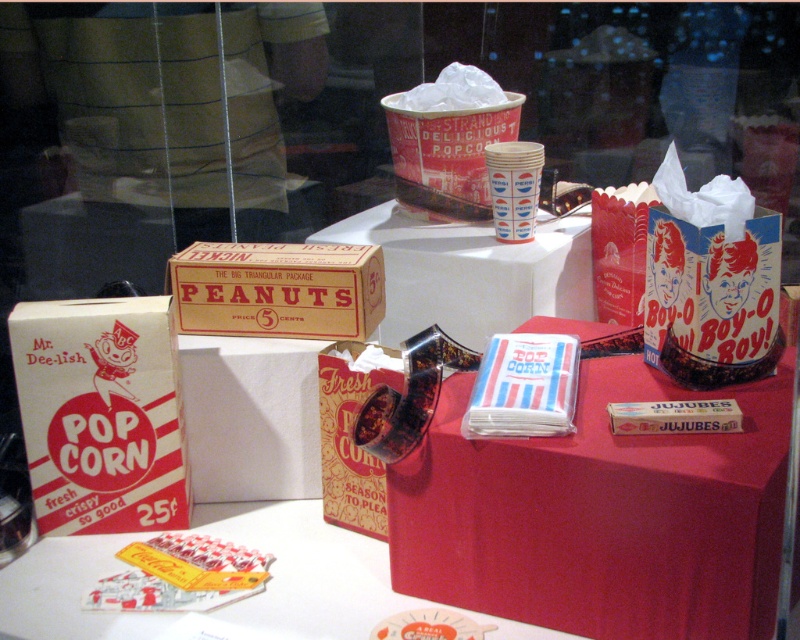
Between white paper table at lower center and matte paper candy at lower left, which one has less height?

matte paper candy at lower left

Between white paper table at lower center and matte paper candy at lower left, which one has more height?

With more height is white paper table at lower center.

Is point (277, 540) positioned after point (220, 582)?

That is True.

This screenshot has height=640, width=800. I want to click on white paper table at lower center, so click(308, 570).

Is brown cardboard box at center to the left of matte paper candy at lower left from the viewer's perspective?

Incorrect, brown cardboard box at center is not on the left side of matte paper candy at lower left.

Which is behind, point (258, 243) or point (236, 573)?

Positioned behind is point (258, 243).

Where is `brown cardboard box at center`? brown cardboard box at center is located at coordinates (277, 289).

Does point (154, 314) lie in front of point (364, 260)?

Yes, point (154, 314) is closer to viewer.

Can you confirm if white paper popcorn at lower left is shorter than brown cardboard box at center?

No, white paper popcorn at lower left is not shorter than brown cardboard box at center.

Where is `white paper popcorn at lower left`? white paper popcorn at lower left is located at coordinates (102, 413).